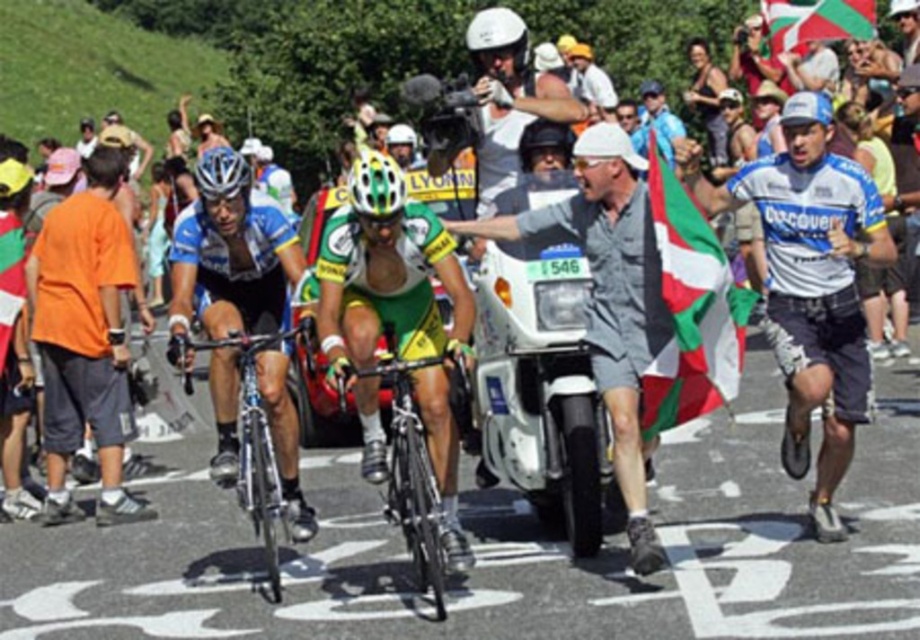
Question: Among these objects, which one is nearest to the camera?

Choices:
 (A) green fabric flag at upper center
 (B) green matte bicycle helmet at center

Answer: (B)

Question: Does green and white fabric flag at center-right have a larger size compared to green matte bicycle helmet at center?

Choices:
 (A) no
 (B) yes

Answer: (B)

Question: Does orange cotton shirt at left have a smaller size compared to white matte helmet at upper center?

Choices:
 (A) no
 (B) yes

Answer: (B)

Question: Among these objects, which one is farthest from the camera?

Choices:
 (A) white matte helmet at upper center
 (B) shiny black frame at center
 (C) green and white fabric flag at center-right
 (D) green fabric flag at left

Answer: (D)

Question: In this image, where is white plastic motorcycle at center located relative to white matte bicycle helmet at center?

Choices:
 (A) above
 (B) below

Answer: (B)

Question: Based on their relative distances, which object is farther from the shiny black frame at center?

Choices:
 (A) white matte bicycle helmet at center
 (B) white matte helmet at upper center
 (C) green fabric flag at left
 (D) silver metallic bicycle at center

Answer: (B)